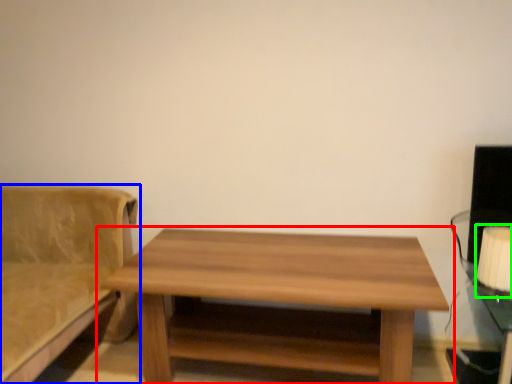
Question: Which object is the closest to the table (highlighted by a red box)? Choose among these: studio couch (highlighted by a blue box) or table lamp (highlighted by a green box).

Choices:
 (A) studio couch
 (B) table lamp

Answer: (A)